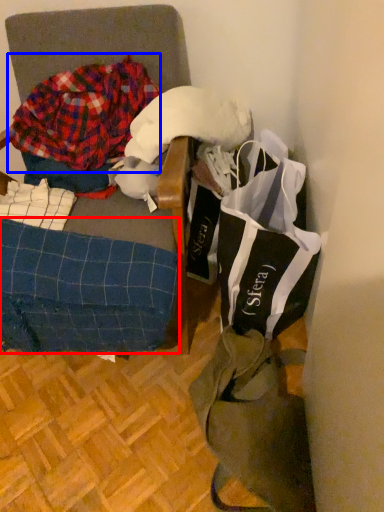
Question: Among these objects, which one is farthest to the camera, underclothes (highlighted by a red box) or flannel (highlighted by a blue box)?

Choices:
 (A) underclothes
 (B) flannel

Answer: (B)